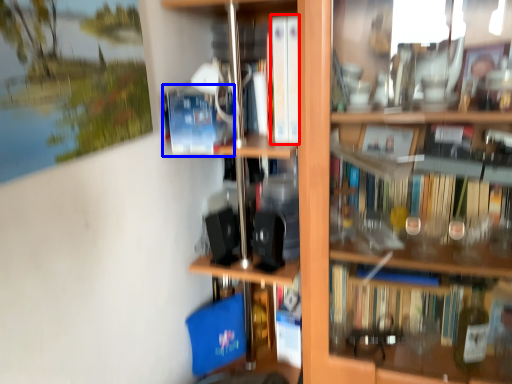
Question: Which object is further to the camera taking this photo, book (highlighted by a red box) or paperback book (highlighted by a blue box)?

Choices:
 (A) book
 (B) paperback book

Answer: (A)